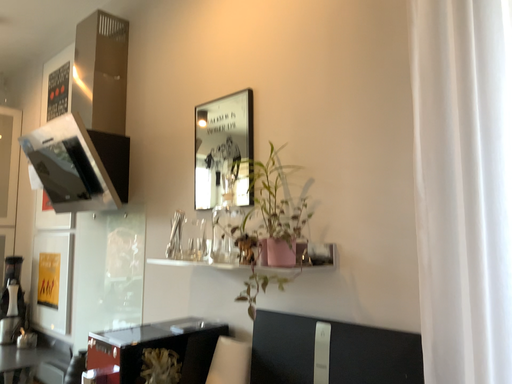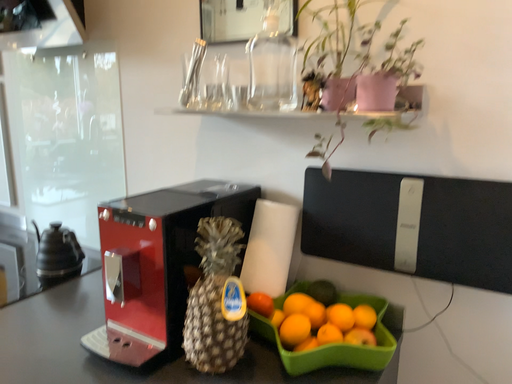
Question: How did the camera likely rotate when shooting the video?

Choices:
 (A) rotated upward
 (B) rotated downward

Answer: (B)